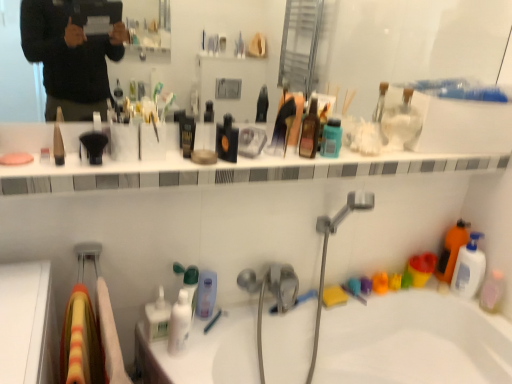
Question: In terms of width, does black glass bottle at center, which ranks as the 2th toiletry in top-to-bottom order, look wider or thinner when compared to white glossy jar at upper center, which appears as the 1th toiletry when viewed from the right?

Choices:
 (A) wide
 (B) thin

Answer: (A)

Question: Considering the positions of black glass bottle at center, which ranks as the 5th toiletry in bottom-to-top order, and white glossy jar at upper center, which ranks as the 6th toiletry in bottom-to-top order, in the image, is black glass bottle at center, which ranks as the 5th toiletry in bottom-to-top order, bigger or smaller than white glossy jar at upper center, which ranks as the 6th toiletry in bottom-to-top order,?

Choices:
 (A) small
 (B) big

Answer: (A)

Question: Which of these objects is positioned farthest from the shiny brown bottle at center, which is the second cleaning product from left to right?

Choices:
 (A) transparent glass mirror at upper center
 (B) white plastic mouthwash at right, the 2th mouthwash in the bottom-to-top sequence
 (C) black glass bottle at center, which ranks as the 5th toiletry in bottom-to-top order
 (D) white glossy bottle at center, the third cleaning product when ordered from top to bottom
 (E) translucent plastic mouthwash at lower right, the 1th mouthwash in the bottom-to-top sequence

Answer: (A)

Question: Which object is positioned closest to the white glossy ledge at upper center?

Choices:
 (A) white glossy pump bottle at lower center, the second toiletry in the left-to-right sequence
 (B) teal plastic mouthwash at center, marked as the 1th mouthwash in a top-to-bottom arrangement
 (C) matte black pencil at upper left, the 6th toiletry viewed from the right
 (D) black glass bottle at center, which ranks as the 2th toiletry in top-to-bottom order
 (E) transparent glass mirror at upper center

Answer: (D)